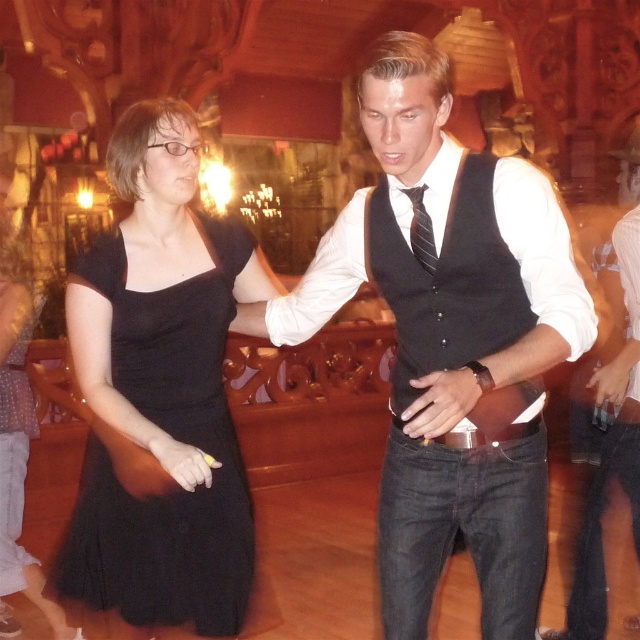
Is black wool vest at center bigger than striped fabric tie at center?

Yes, black wool vest at center is bigger than striped fabric tie at center.

Consider the image. Who is positioned more to the right, black wool vest at center or striped fabric tie at center?

black wool vest at center is more to the right.

Find the location of a particular element. The height and width of the screenshot is (640, 640). black wool vest at center is located at coordinates (445, 282).

Where is `black wool vest at center`? The width and height of the screenshot is (640, 640). black wool vest at center is located at coordinates (x=445, y=282).

Which is above, black matte vest at center or striped fabric tie at center?

striped fabric tie at center is above.

Between point (480, 438) and point (426, 259), which one is positioned behind?

Positioned behind is point (426, 259).

You are a GUI agent. You are given a task and a screenshot of the screen. Output one action in this format:
    pyautogui.click(x=<x>, y=<y>)
    Task: Click on the black matte vest at center
    The width and height of the screenshot is (640, 640).
    Given the screenshot: What is the action you would take?
    pyautogui.click(x=449, y=340)

Does black matte vest at center appear on the right side of black wool vest at center?

Incorrect, black matte vest at center is not on the right side of black wool vest at center.

Does black matte vest at center have a lesser width compared to black wool vest at center?

In fact, black matte vest at center might be wider than black wool vest at center.

Which is behind, point (522, 296) or point (444, 296)?

The point (444, 296) is behind.

This screenshot has height=640, width=640. I want to click on black matte vest at center, so click(x=449, y=340).